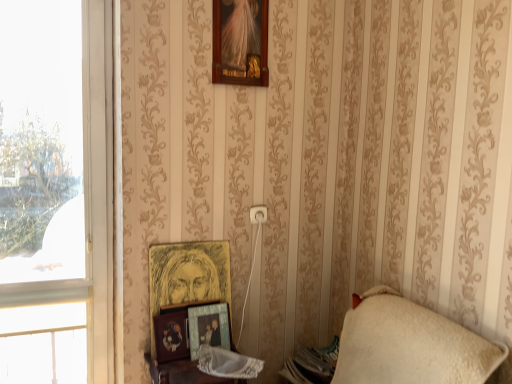
Question: Is white fabric window at left, which is the second window from top to bottom, far from transparent glass window at left, the first window from the top?

Choices:
 (A) yes
 (B) no

Answer: (B)

Question: Is white fabric window at left, the 1th window from the bottom, not inside transparent glass window at left, the 2th window in the bottom-to-top sequence?

Choices:
 (A) yes
 (B) no

Answer: (A)

Question: Does white fabric window at left, the 1th window from the bottom, have a lesser height compared to transparent glass window at left, the 2th window in the bottom-to-top sequence?

Choices:
 (A) no
 (B) yes

Answer: (B)

Question: Is white fabric window at left, the 1th window from the bottom, bigger than transparent glass window at left, the first window from the top?

Choices:
 (A) no
 (B) yes

Answer: (A)

Question: Does white fabric window at left, which is the second window from top to bottom, appear on the left side of transparent glass window at left, the 2th window in the bottom-to-top sequence?

Choices:
 (A) yes
 (B) no

Answer: (B)

Question: From the image's perspective, is white fabric window at left, the 1th window from the bottom, beneath transparent glass window at left, the first window from the top?

Choices:
 (A) no
 (B) yes

Answer: (B)

Question: Is wooden frame at upper center, the 4th picture frame when ordered from bottom to top, far from wooden table at lower center?

Choices:
 (A) no
 (B) yes

Answer: (B)

Question: Could you tell me if wooden frame at upper center, the 4th picture frame when ordered from bottom to top, is facing wooden table at lower center?

Choices:
 (A) no
 (B) yes

Answer: (A)

Question: Does wooden frame at upper center, the 1th picture frame from the top, have a greater width compared to wooden table at lower center?

Choices:
 (A) yes
 (B) no

Answer: (B)

Question: Does wooden frame at upper center, the 1th picture frame from the top, have a greater height compared to wooden table at lower center?

Choices:
 (A) no
 (B) yes

Answer: (B)

Question: Is wooden frame at upper center, the 4th picture frame when ordered from bottom to top, facing away from wooden table at lower center?

Choices:
 (A) yes
 (B) no

Answer: (B)

Question: Considering the relative sizes of wooden frame at upper center, the 4th picture frame when ordered from bottom to top, and wooden table at lower center in the image provided, is wooden frame at upper center, the 4th picture frame when ordered from bottom to top, shorter than wooden table at lower center?

Choices:
 (A) no
 (B) yes

Answer: (A)

Question: Can we say metallic silver frame at lower center, positioned as the 1th picture frame in bottom-to-top order, lies outside wooden table at lower center?

Choices:
 (A) no
 (B) yes

Answer: (B)